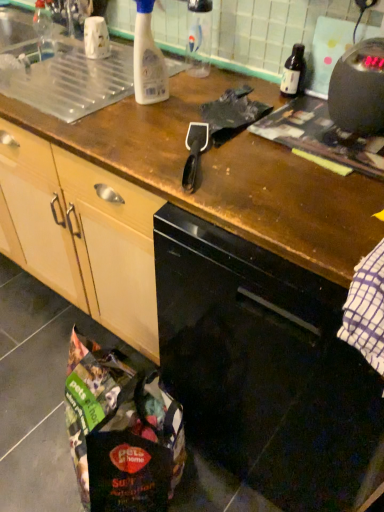
Find the location of a particular element. This screenshot has width=384, height=512. vacant space to the right of translucent plastic spray bottle at upper center, arranged as the first bottle when viewed from the left is located at coordinates (195, 95).